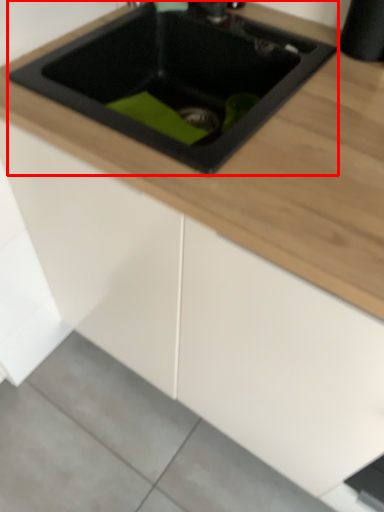
Question: From the image's perspective, where is sink (annotated by the red box) located relative to concrete?

Choices:
 (A) below
 (B) above

Answer: (B)